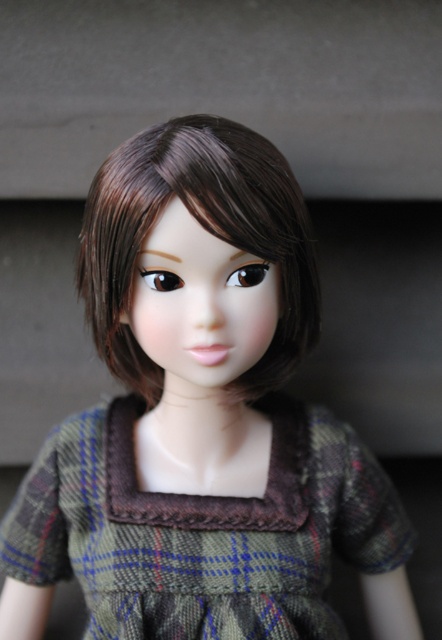
Question: Can you confirm if plaid fabric dress at center is positioned above brown silky hair at center?

Choices:
 (A) no
 (B) yes

Answer: (A)

Question: Which point is closer to the camera?

Choices:
 (A) brown silky hair at center
 (B) plaid fabric dress at center

Answer: (A)

Question: Can you confirm if plaid fabric dress at center is positioned above brown silky hair at center?

Choices:
 (A) no
 (B) yes

Answer: (A)

Question: Considering the relative positions of plaid fabric dress at center and brown silky hair at center in the image provided, where is plaid fabric dress at center located with respect to brown silky hair at center?

Choices:
 (A) right
 (B) left

Answer: (A)